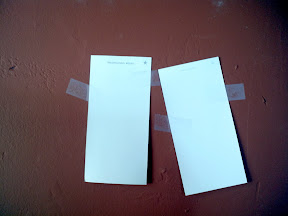
Locate an element on the screen. Image resolution: width=288 pixels, height=216 pixels. wall is located at coordinates (162, 171).